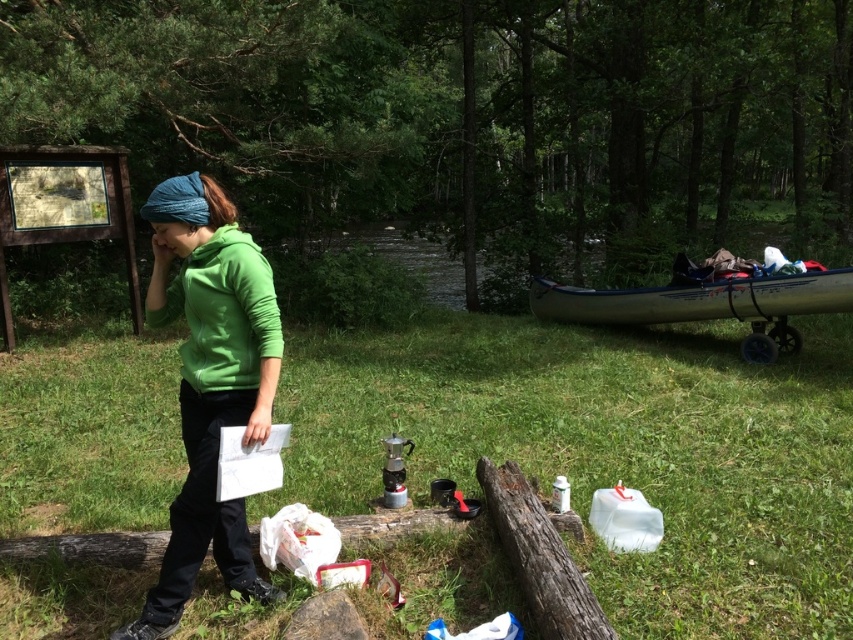
Between green grass at center and white plastic canoe at right, which one is positioned lower?

green grass at center is lower down.

Is point (608, 336) in front of point (665, 323)?

That is False.

What do you see at coordinates (608, 451) in the screenshot? The width and height of the screenshot is (853, 640). I see `green grass at center` at bounding box center [608, 451].

Identify the location of green grass at center. Image resolution: width=853 pixels, height=640 pixels. click(608, 451).

Who is shorter, green grass at center or green fleece jacket at center?

With less height is green grass at center.

Between green grass at center and green fleece jacket at center, which one is positioned lower?

green grass at center is lower down.

Is point (544, 435) farther from viewer compared to point (227, 234)?

That is True.

Locate an element on the screen. Image resolution: width=853 pixels, height=640 pixels. green grass at center is located at coordinates (608, 451).

Does blue plastic canoe at right have a greater width compared to rough wooden log at lower center?

Yes.

The width and height of the screenshot is (853, 640). I want to click on blue plastic canoe at right, so click(x=697, y=300).